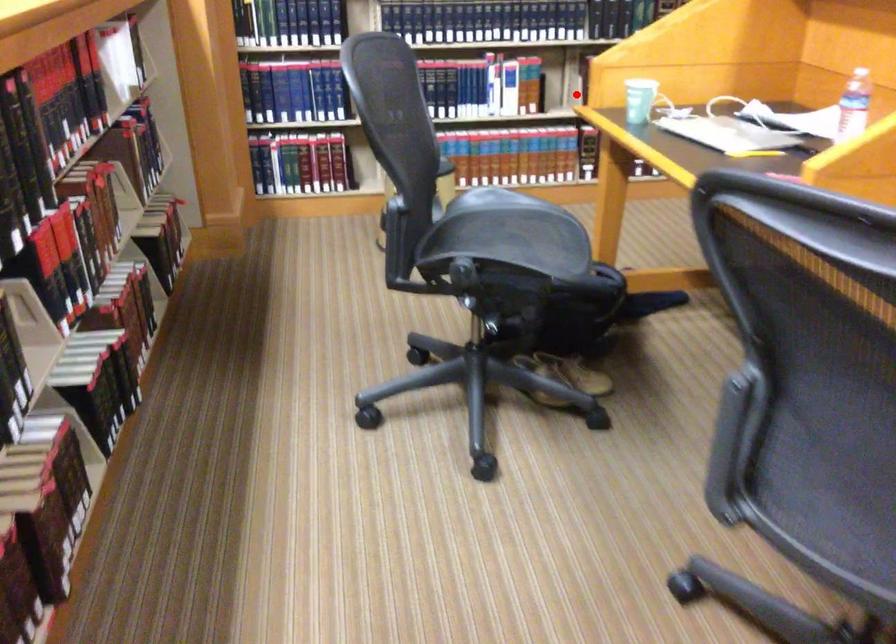
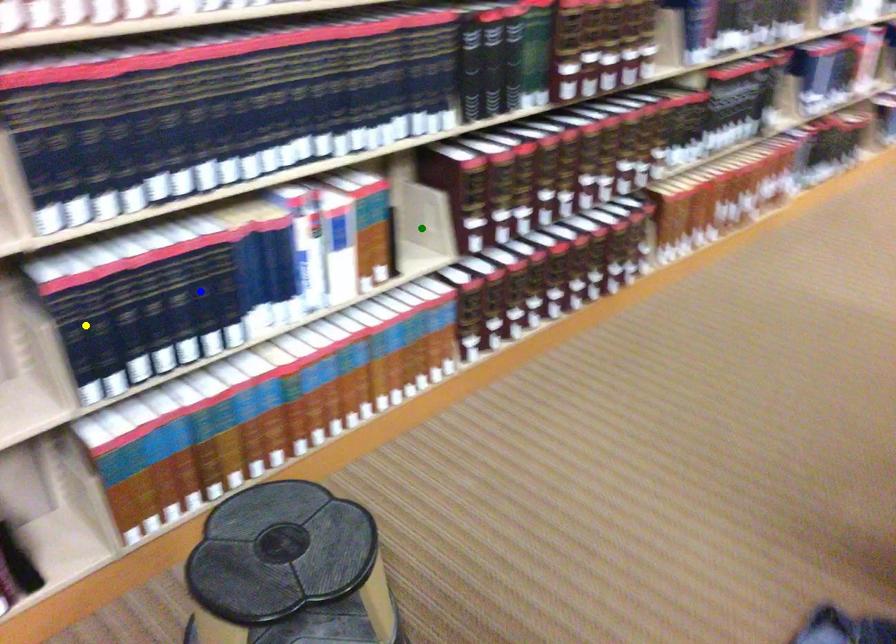
Question: I am providing you with two images of the same scene from different viewpoints. A red point is marked on the first image. You are given multiple points on the second image. Which spot in image 2 lines up with the point in image 1?

Choices:
 (A) yellow point
 (B) blue point
 (C) green point

Answer: (C)